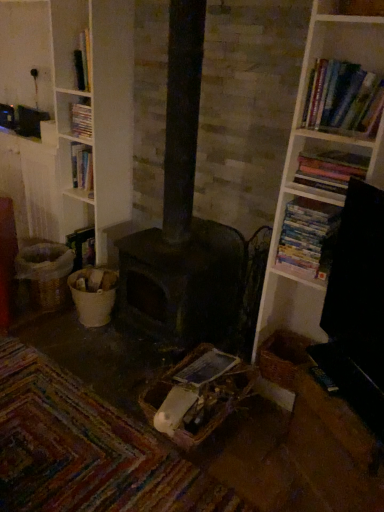
Image resolution: width=384 pixels, height=512 pixels. Describe the element at coordinates (81, 120) in the screenshot. I see `hardcover book at upper left, the 1th book in the left-to-right sequence` at that location.

Describe the element at coordinates (283, 357) in the screenshot. I see `woven brown basket at lower right, which is the first basket from right to left` at that location.

Identify the location of hardcover books at upper right, the fourth book from the back. This screenshot has height=512, width=384. (342, 98).

The width and height of the screenshot is (384, 512). Describe the element at coordinates (197, 394) in the screenshot. I see `woven brown basket at center, the first basket positioned from the front` at that location.

Where is `white paperbacks at right, arranged as the second book when viewed from the left`? Image resolution: width=384 pixels, height=512 pixels. white paperbacks at right, arranged as the second book when viewed from the left is located at coordinates (308, 238).

Could you tell me if dark matte heater at center is facing hardcover book at upper left, which ranks as the first book in back-to-front order?

No, dark matte heater at center is not facing towards hardcover book at upper left, which ranks as the first book in back-to-front order.

From a real-world perspective, is dark matte heater at center physically located above or below hardcover book at upper left, which ranks as the 4th book in right-to-left order?

dark matte heater at center is situated lower than hardcover book at upper left, which ranks as the 4th book in right-to-left order, in the real world.

Considering the points (193, 224) and (91, 136), which point is behind, point (193, 224) or point (91, 136)?

The point (91, 136) is farther.

Is woven brown basket at lower left, placed as the 1th basket when sorted from left to right, in front of or behind woven brown basket at center, the first basket positioned from the front, in the image?

woven brown basket at lower left, placed as the 1th basket when sorted from left to right, is behind woven brown basket at center, the first basket positioned from the front.

Locate an element on the screen. the 2nd basket directly above the woven brown basket at center, which is counted as the second basket, starting from the right (from a real-world perspective) is located at coordinates (45, 273).

Measure the distance from woven brown basket at lower left, the third basket viewed from the front, to woven brown basket at center, the 2th basket when ordered from left to right.

woven brown basket at lower left, the third basket viewed from the front, and woven brown basket at center, the 2th basket when ordered from left to right, are 1.16 meters apart.

From a real-world perspective, which object stands above the other?

hardcover books at upper right, which appears as the second book when viewed from the front.

Which object is further away from the camera, hardcover books at upper right, which is counted as the third book, starting from the left, or woven brown basket at center, the first basket positioned from the front?

woven brown basket at center, the first basket positioned from the front.

What's the angular difference between hardcover books at upper right, which is counted as the 3th book, starting from the back, and woven brown basket at center, the 2th basket when ordered from left to right,'s facing directions?

A: The facing directions of hardcover books at upper right, which is counted as the 3th book, starting from the back, and woven brown basket at center, the 2th basket when ordered from left to right, are 0.0263 degrees apart.

Does hardcover books at upper right, which is counted as the 3th book, starting from the back, have a lesser width compared to woven brown basket at center, the first basket positioned from the front?

Yes.

Measure the distance from hardcover books at upper right, which appears as the second book when viewed from the front, to dark matte heater at center.

32.01 inches.

Is hardcover books at upper right, which is counted as the 3th book, starting from the back, bigger than dark matte heater at center?

No.

Based on the photo, is hardcover books at upper right, which is counted as the third book, starting from the left, looking in the opposite direction of dark matte heater at center?

hardcover books at upper right, which is counted as the third book, starting from the left, does not have its back to dark matte heater at center.

Is hardcover books at upper right, which is counted as the 3th book, starting from the back, inside or outside of dark matte heater at center?

hardcover books at upper right, which is counted as the 3th book, starting from the back, is spatially situated outside dark matte heater at center.

From the image's perspective, would you say dark matte heater at center is shown under woven brown basket at lower left, the third basket when ordered from right to left?

No, from the image's perspective, dark matte heater at center is not beneath woven brown basket at lower left, the third basket when ordered from right to left.

From their relative heights in the image, would you say dark matte heater at center is taller or shorter than woven brown basket at lower left, the third basket viewed from the front?

dark matte heater at center is taller than woven brown basket at lower left, the third basket viewed from the front.

Would you say dark matte heater at center contains woven brown basket at lower left, the 1th basket when ordered from back to front?

No, dark matte heater at center does not contain woven brown basket at lower left, the 1th basket when ordered from back to front.

Between point (198, 285) and point (27, 249), which one is positioned behind?

The point (27, 249) is more distant.

From the image's perspective, between hardcover books at upper right, which ranks as the first book in front-to-back order, and woven brown basket at center, the 2th basket when ordered from left to right, which one is located above?

hardcover books at upper right, which ranks as the first book in front-to-back order.

Which is in front, point (339, 66) or point (176, 435)?

Positioned in front is point (339, 66).

Which is in front, hardcover books at upper right, marked as the 4th book in a left-to-right arrangement, or woven brown basket at center, which is counted as the second basket, starting from the right?

Positioned in front is hardcover books at upper right, marked as the 4th book in a left-to-right arrangement.

Is woven brown basket at lower right, which is the second basket from front to back, oriented away from hardcover books at upper right, which ranks as the first book in front-to-back order?

No, woven brown basket at lower right, which is the second basket from front to back, is not facing away from hardcover books at upper right, which ranks as the first book in front-to-back order.

Considering the relative sizes of woven brown basket at lower right, which is the second basket from front to back, and hardcover books at upper right, the fourth book from the back, in the image provided, is woven brown basket at lower right, which is the second basket from front to back, bigger than hardcover books at upper right, the fourth book from the back,?

Incorrect, woven brown basket at lower right, which is the second basket from front to back, is not larger than hardcover books at upper right, the fourth book from the back.

Is woven brown basket at lower right, which is the second basket from front to back, beside hardcover books at upper right, which ranks as the first book in front-to-back order?

No, woven brown basket at lower right, which is the second basket from front to back, is not next to hardcover books at upper right, which ranks as the first book in front-to-back order.

Identify the location of heater in front of the hardcover book at upper left, which ranks as the first book in back-to-front order. This screenshot has height=512, width=384. (183, 284).

At what (x,y) coordinates should I click in order to perform the action: click on the 2nd basket below the woven brown basket at lower left, the third basket when ordered from right to left (from the image's perspective). Please return your answer as a coordinate pair (x, y). The image size is (384, 512). Looking at the image, I should click on (197, 394).

Considering their positions, is dark matte heater at center positioned closer to woven brown basket at center, the 2th basket when ordered from left to right, than hardcover book at upper left, which is counted as the fourth book, starting from the front?

dark matte heater at center lies closer to woven brown basket at center, the 2th basket when ordered from left to right, than the other object.

Which object lies nearer to the anchor point white paperbacks at right, which is the 2th book in back-to-front order, woven brown basket at center, the first basket positioned from the front, or hardcover books at upper right, the fourth book from the back?

hardcover books at upper right, the fourth book from the back, is positioned closer to the anchor white paperbacks at right, which is the 2th book in back-to-front order.

Based on their spatial positions, is hardcover books at upper right, the fourth book from the back, or woven brown basket at lower right, which appears as the 2th basket when viewed from the back, further from hardcover books at upper right, which appears as the second book when viewed from the front?

woven brown basket at lower right, which appears as the 2th basket when viewed from the back, is positioned further to the anchor hardcover books at upper right, which appears as the second book when viewed from the front.

Looking at the image, which one is located closer to woven brown basket at lower right, the 3th basket viewed from the left, white paperbacks at right, arranged as the second book when viewed from the left, or hardcover books at upper right, which is counted as the first book, starting from the right?

white paperbacks at right, arranged as the second book when viewed from the left, is positioned closer to the anchor woven brown basket at lower right, the 3th basket viewed from the left.

Based on their spatial positions, is woven brown basket at lower right, the 3th basket viewed from the left, or woven brown basket at lower left, the third basket when ordered from right to left, closer to hardcover books at upper right, which is counted as the third book, starting from the left?

woven brown basket at lower right, the 3th basket viewed from the left, is closer to hardcover books at upper right, which is counted as the third book, starting from the left.

Considering their positions, is hardcover books at upper right, marked as the 4th book in a left-to-right arrangement, positioned closer to hardcover books at upper right, which appears as the 2th book when viewed from the right, than white paperbacks at right, arranged as the second book when viewed from the left?

Among the two, white paperbacks at right, arranged as the second book when viewed from the left, is located nearer to hardcover books at upper right, which appears as the 2th book when viewed from the right.

Which object lies further to the anchor point woven brown basket at lower left, the 1th basket when ordered from back to front, hardcover book at upper left, the 1th book in the left-to-right sequence, or hardcover books at upper right, which appears as the 2th book when viewed from the right?

hardcover books at upper right, which appears as the 2th book when viewed from the right.

When comparing their distances from hardcover books at upper right, which ranks as the first book in front-to-back order, does dark matte heater at center or hardcover books at upper right, which is counted as the 3th book, starting from the back, seem further?

dark matte heater at center.

Identify the location of heater between hardcover book at upper left, which ranks as the 4th book in right-to-left order, and woven brown basket at center, the first basket positioned from the front, in the vertical direction. (183, 284).

Locate an element on the screen. Image resolution: width=384 pixels, height=512 pixels. heater located between woven brown basket at lower left, the third basket viewed from the front, and woven brown basket at center, which is counted as the second basket, starting from the right, in the left-right direction is located at coordinates (183, 284).

Identify the location of heater between hardcover book at upper left, which ranks as the first book in back-to-front order, and woven brown basket at lower right, which appears as the 2th basket when viewed from the back, from top to bottom. The height and width of the screenshot is (512, 384). (183, 284).

Find the location of a particular element. This screenshot has height=512, width=384. book between hardcover books at upper right, which is counted as the third book, starting from the left, and dark matte heater at center from front to back is located at coordinates (308, 238).